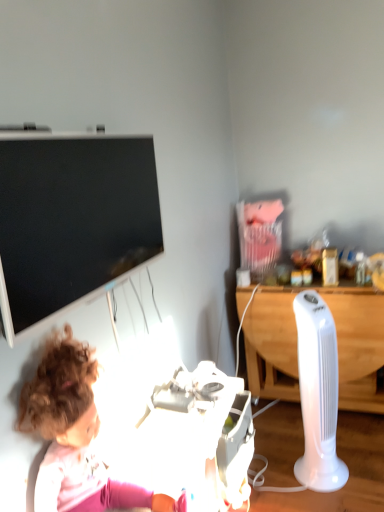
Find the location of `white wood desk at right`. white wood desk at right is located at coordinates (358, 345).

In order to click on curly-haired doll at lower left in this screenshot , I will do [x=74, y=434].

This screenshot has height=512, width=384. I want to click on white wood desk at right, so click(x=358, y=345).

This screenshot has width=384, height=512. I want to click on person that appears above the white plastic toy at lower center, the second equipment from the right (from a real-world perspective), so click(x=74, y=434).

Is curly-haired doll at lower left closer to the viewer compared to white plastic toy at lower center, which is counted as the first equipment, starting from the left?

Yes, the depth of curly-haired doll at lower left is less than that of white plastic toy at lower center, which is counted as the first equipment, starting from the left.

Which object is positioned more to the left, curly-haired doll at lower left or white plastic toy at lower center, which is counted as the first equipment, starting from the left?

curly-haired doll at lower left.

Looking at the image, does curly-haired doll at lower left seem bigger or smaller compared to white plastic toy at lower center, the second equipment from the right?

In the image, curly-haired doll at lower left appears to be smaller than white plastic toy at lower center, the second equipment from the right.

From the image's perspective, between curly-haired doll at lower left and white wood desk at right, who is located below?

white wood desk at right is shown below in the image.

Which object is thinner, curly-haired doll at lower left or white wood desk at right?

curly-haired doll at lower left.

Is curly-haired doll at lower left facing away from white wood desk at right?

No.

In terms of height, does curly-haired doll at lower left look taller or shorter compared to white wood desk at right?

Clearly, curly-haired doll at lower left is shorter compared to white wood desk at right.

Does white plastic toy at lower center, which is counted as the first equipment, starting from the left, appear on the right side of white plastic fan at right, acting as the first equipment starting from the right?

No, white plastic toy at lower center, which is counted as the first equipment, starting from the left, is not to the right of white plastic fan at right, acting as the first equipment starting from the right.

At what (x,y) coordinates should I click in order to perform the action: click on equipment that is under the white plastic fan at right, acting as the first equipment starting from the right (from a real-world perspective). Please return your answer as a coordinate pair (x, y). Looking at the image, I should click on (201, 437).

From the image's perspective, which is below, white plastic toy at lower center, which is counted as the first equipment, starting from the left, or white plastic fan at right, the second equipment viewed from the left?

white plastic toy at lower center, which is counted as the first equipment, starting from the left, appears lower in the image.

Can you see white plastic toy at lower center, the second equipment from the right, touching white plastic fan at right, the second equipment viewed from the left?

white plastic toy at lower center, the second equipment from the right, is not next to white plastic fan at right, the second equipment viewed from the left, and they're not touching.

Who is shorter, white plastic toy at lower center, which is counted as the first equipment, starting from the left, or curly-haired doll at lower left?

Standing shorter between the two is curly-haired doll at lower left.

Considering the sizes of objects white plastic toy at lower center, which is counted as the first equipment, starting from the left, and curly-haired doll at lower left in the image provided, who is bigger, white plastic toy at lower center, which is counted as the first equipment, starting from the left, or curly-haired doll at lower left?

white plastic toy at lower center, which is counted as the first equipment, starting from the left.

From a real-world perspective, is white plastic toy at lower center, the second equipment from the right, on top of curly-haired doll at lower left?

Incorrect, from a real-world perspective, white plastic toy at lower center, the second equipment from the right, is lower than curly-haired doll at lower left.

Based on the photo, is white plastic toy at lower center, the second equipment from the right, at the right side of curly-haired doll at lower left?

Correct, you'll find white plastic toy at lower center, the second equipment from the right, to the right of curly-haired doll at lower left.

Does black glossy television at upper left have a lesser height compared to white plastic fan at right, the second equipment viewed from the left?

Yes.

From the image's perspective, which object appears higher, black glossy television at upper left or white plastic fan at right, the second equipment viewed from the left?

From the image's view, black glossy television at upper left is above.

Is black glossy television at upper left surrounding white plastic fan at right, acting as the first equipment starting from the right?

No, white plastic fan at right, acting as the first equipment starting from the right, is located outside of black glossy television at upper left.

Measure the distance between curly-haired doll at lower left and black glossy television at upper left.

The distance of curly-haired doll at lower left from black glossy television at upper left is 12.67 inches.

Can you confirm if curly-haired doll at lower left is shorter than black glossy television at upper left?

No, curly-haired doll at lower left is not shorter than black glossy television at upper left.

Is curly-haired doll at lower left next to black glossy television at upper left and touching it?

They are not placed beside each other.

Based on the photo, measure the distance from white plastic fan at right, the second equipment viewed from the left, to white plastic toy at lower center, the second equipment from the right.

white plastic fan at right, the second equipment viewed from the left, and white plastic toy at lower center, the second equipment from the right, are 19.82 inches apart.

In the scene shown: Does white plastic fan at right, the second equipment viewed from the left, have a greater height compared to white plastic toy at lower center, the second equipment from the right?

Yes.

From the image's perspective, between white plastic fan at right, the second equipment viewed from the left, and white plastic toy at lower center, which is counted as the first equipment, starting from the left, which one is located above?

From the image's view, white plastic fan at right, the second equipment viewed from the left, is above.

Is white plastic fan at right, the second equipment viewed from the left, next to white plastic toy at lower center, which is counted as the first equipment, starting from the left, and touching it?

No.

Find the location of `person above the white plastic toy at lower center, the second equipment from the right (from a real-world perspective)`. person above the white plastic toy at lower center, the second equipment from the right (from a real-world perspective) is located at coordinates (74, 434).

The width and height of the screenshot is (384, 512). In order to click on person on the left of white wood desk at right in this screenshot , I will do `click(74, 434)`.

Considering their positions, is curly-haired doll at lower left positioned further to black glossy television at upper left than white plastic fan at right, acting as the first equipment starting from the right?

white plastic fan at right, acting as the first equipment starting from the right, is positioned further to the anchor black glossy television at upper left.

Estimate the real-world distances between objects in this image. Which object is further from white wood desk at right, white plastic toy at lower center, the second equipment from the right, or black glossy television at upper left?

Among the two, black glossy television at upper left is located further to white wood desk at right.

Considering their positions, is curly-haired doll at lower left positioned further to white plastic fan at right, acting as the first equipment starting from the right, than white plastic toy at lower center, which is counted as the first equipment, starting from the left?

curly-haired doll at lower left.

Which object lies further to the anchor point white plastic toy at lower center, the second equipment from the right, white plastic fan at right, acting as the first equipment starting from the right, or white wood desk at right?

white wood desk at right is further to white plastic toy at lower center, the second equipment from the right.

Considering their positions, is white plastic fan at right, the second equipment viewed from the left, positioned further to curly-haired doll at lower left than white plastic toy at lower center, which is counted as the first equipment, starting from the left?

Based on the image, white plastic fan at right, the second equipment viewed from the left, appears to be further to curly-haired doll at lower left.

Which object lies further to the anchor point white wood desk at right, white plastic toy at lower center, the second equipment from the right, or white plastic fan at right, acting as the first equipment starting from the right?

white plastic toy at lower center, the second equipment from the right, is further to white wood desk at right.

From the picture: Estimate the real-world distances between objects in this image. Which object is further from white wood desk at right, white plastic fan at right, the second equipment viewed from the left, or white plastic toy at lower center, the second equipment from the right?

white plastic toy at lower center, the second equipment from the right.

Looking at the image, which one is located closer to white plastic fan at right, the second equipment viewed from the left, white plastic toy at lower center, which is counted as the first equipment, starting from the left, or black glossy television at upper left?

Among the two, white plastic toy at lower center, which is counted as the first equipment, starting from the left, is located nearer to white plastic fan at right, the second equipment viewed from the left.

Locate an element on the screen. This screenshot has width=384, height=512. equipment between white plastic toy at lower center, which is counted as the first equipment, starting from the left, and white wood desk at right, along the z-axis is located at coordinates (318, 394).

Find the location of a particular element. equipment between curly-haired doll at lower left and white plastic fan at right, acting as the first equipment starting from the right, in the front-back direction is located at coordinates (201, 437).

Where is `person between black glossy television at upper left and white plastic fan at right, acting as the first equipment starting from the right, in the front-back direction`? The height and width of the screenshot is (512, 384). person between black glossy television at upper left and white plastic fan at right, acting as the first equipment starting from the right, in the front-back direction is located at coordinates (74, 434).

Where is `person between black glossy television at upper left and white plastic toy at lower center, which is counted as the first equipment, starting from the left, in the vertical direction`? person between black glossy television at upper left and white plastic toy at lower center, which is counted as the first equipment, starting from the left, in the vertical direction is located at coordinates (74, 434).